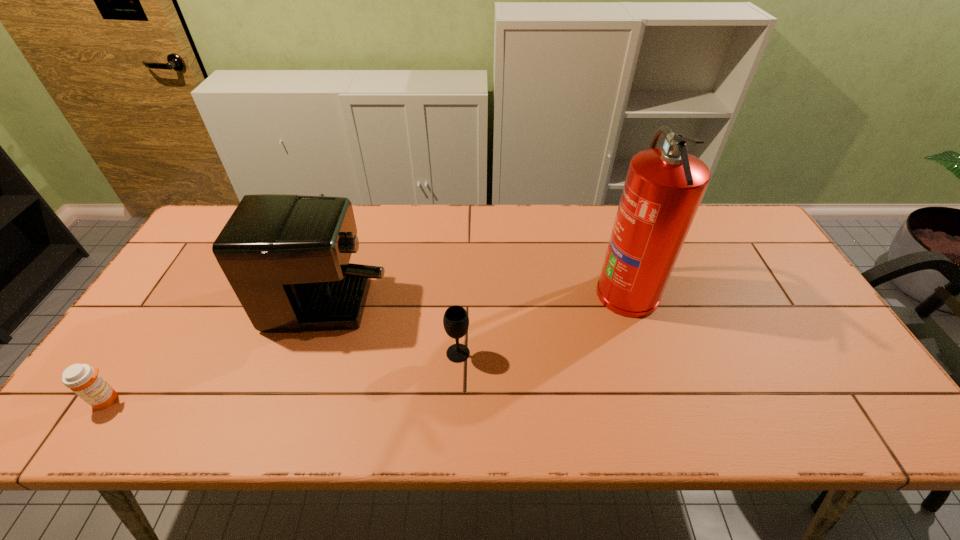
The image size is (960, 540). I want to click on the tallest object, so click(663, 189).

Find the location of `the rightmost object`. the rightmost object is located at coordinates (663, 189).

Where is `the second tallest object`? This screenshot has height=540, width=960. the second tallest object is located at coordinates (286, 257).

At what (x,y) coordinates should I click in order to perform the action: click on coffee maker. Please return your answer as a coordinate pair (x, y). Looking at the image, I should click on (286, 257).

Locate an element on the screen. Image resolution: width=960 pixels, height=540 pixels. the second nearest object is located at coordinates (456, 321).

Find the location of `the third object from left to right`. the third object from left to right is located at coordinates (456, 321).

Identify the location of the leftmost object. (84, 380).

The width and height of the screenshot is (960, 540). Find the location of `the shortest object`. the shortest object is located at coordinates (84, 380).

Locate an element on the screen. This screenshot has height=540, width=960. free location located 0.110m on the instruction side of the rightmost object is located at coordinates (557, 291).

Where is `vacant space situated on the instruction side of the rightmost object`? This screenshot has height=540, width=960. vacant space situated on the instruction side of the rightmost object is located at coordinates (571, 291).